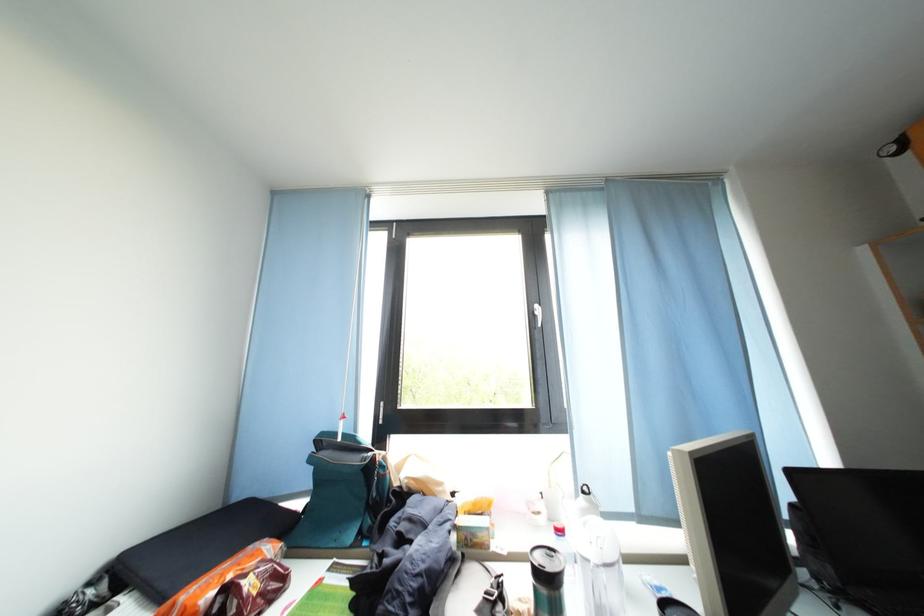
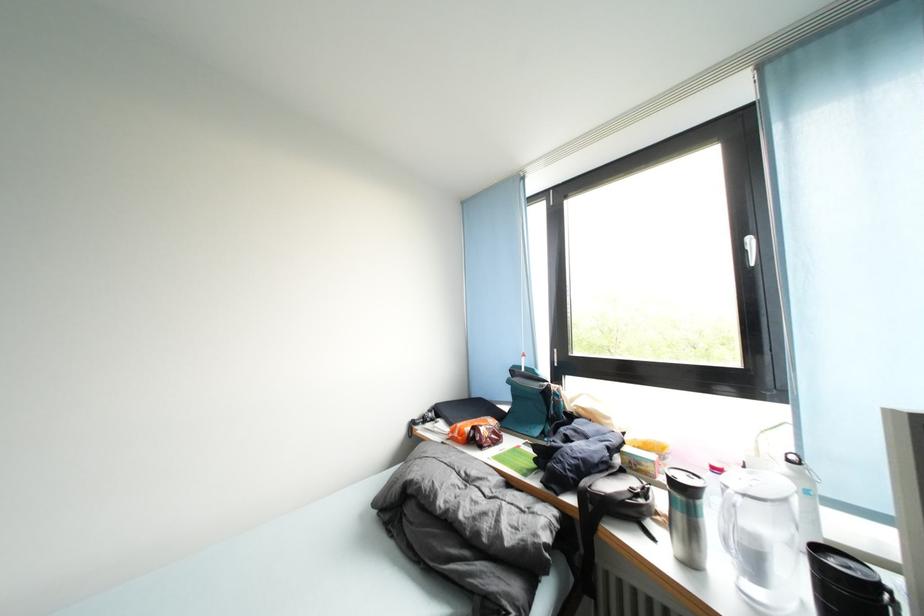
In the second image, find the point that corresponds to point (568, 537) in the first image.

(723, 475)